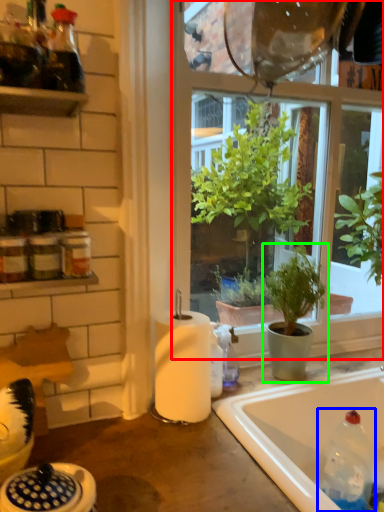
Question: Which is farther away from window (highlighted by a red box)? bottle (highlighted by a blue box) or houseplant (highlighted by a green box)?

Choices:
 (A) bottle
 (B) houseplant

Answer: (A)